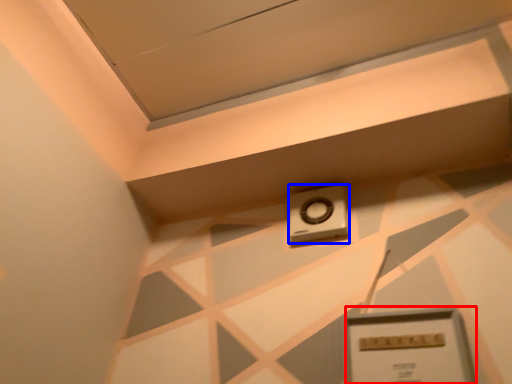
Question: Which object appears farthest to the camera in this image, rectangle (highlighted by a red box) or alarm (highlighted by a blue box)?

Choices:
 (A) rectangle
 (B) alarm

Answer: (B)